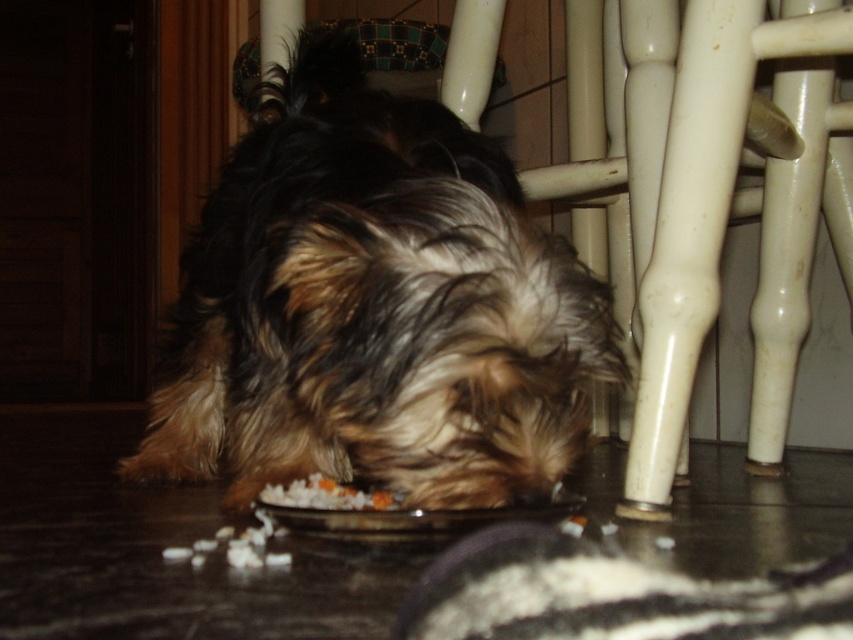
Where is the shaggy brown fur at center located in the image?

The shaggy brown fur at center is located at point (374, 308) in the image.

You are standing in front of the scene and want to know which of the two points, point (x=231, y=189) or point (x=347, y=502), is closer to you. Can you determine this based on their positions?

Point (x=231, y=189) is further to the camera than point (x=347, y=502), so the closer point to you is point (x=347, y=502).